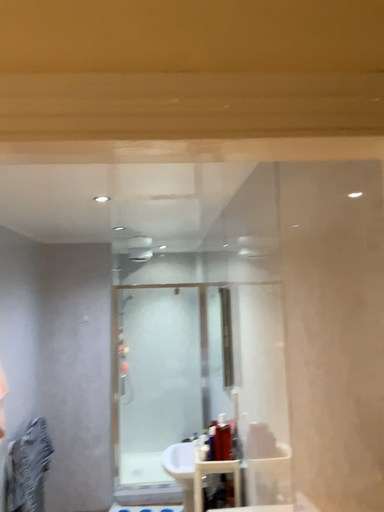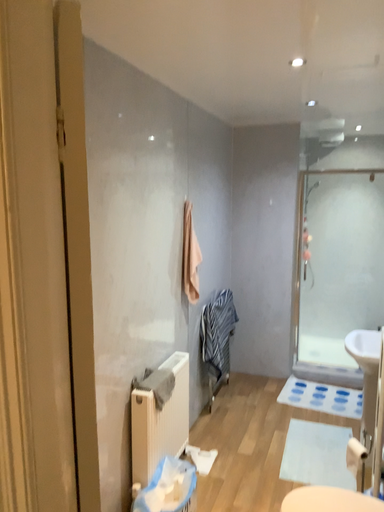
Question: Which way did the camera rotate in the video?

Choices:
 (A) rotated downward
 (B) rotated upward

Answer: (A)